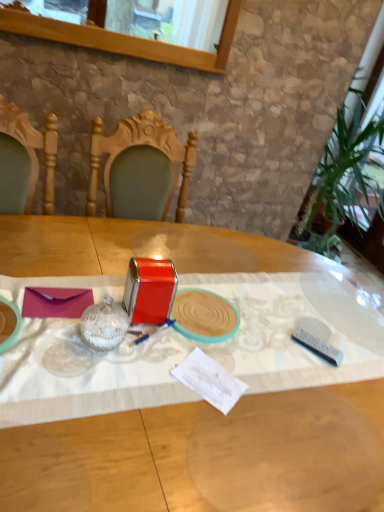
The image size is (384, 512). What are the coordinates of `free space in front of white plastic remote at lower right, acting as the 4th tableware starting from the left` in the screenshot? It's located at (308, 378).